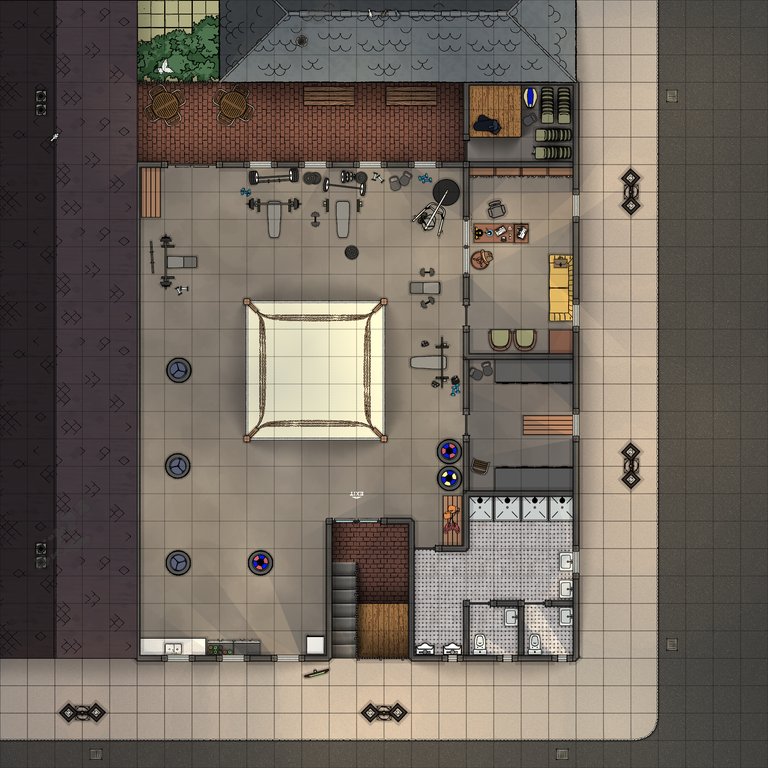
Find the location of a particular element. chair is located at coordinates (525, 343), (490, 333), (246, 107), (240, 91), (214, 94), (223, 120), (170, 118), (147, 111), (151, 81), (181, 90).